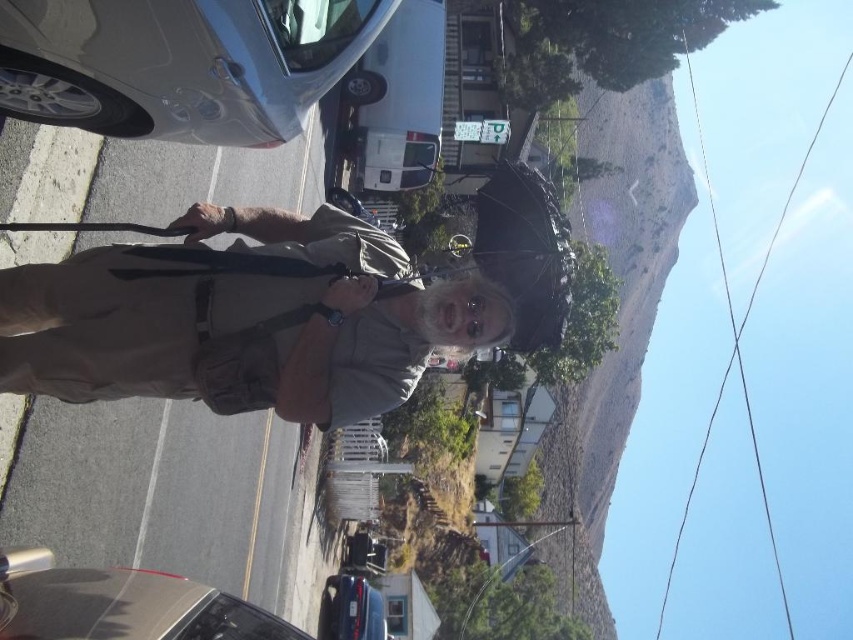
Consider the image. You are a delivery driver who needs to park your shiny black car at lower left in a parking spot that can only accommodate vehicles narrower than the black matte umbrella at center. Can your car fit in the parking spot?

The shiny black car at lower left is wider than the black matte umbrella at center. Since the parking spot requires vehicles narrower than the umbrella, the car cannot fit.

You are a fashion designer observing the scene. You need to compare the size of the khaki fabric shirt at center and the metallic blue sedan at lower center. Which object is wider?

The khaki fabric shirt at center is wider than the metallic blue sedan at lower center according to the description.